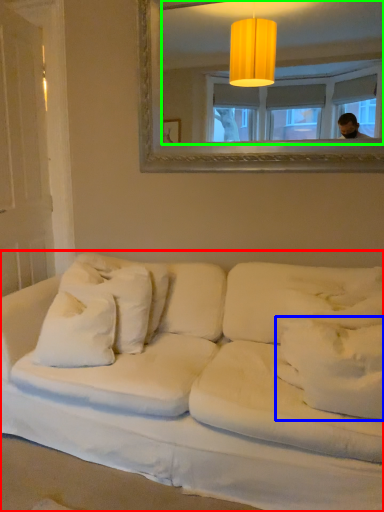
Question: Based on their relative distances, which object is farther from studio couch (highlighted by a red box)? Choose from pillow (highlighted by a blue box) and mirror (highlighted by a green box).

Choices:
 (A) pillow
 (B) mirror

Answer: (B)